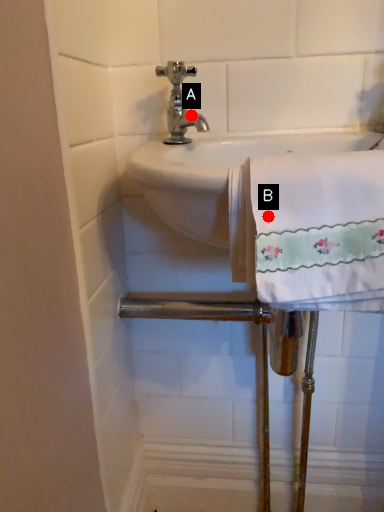
Question: Two points are circled on the image, labeled by A and B beside each circle. Which point is farther to the camera?

Choices:
 (A) A is further
 (B) B is further

Answer: (A)